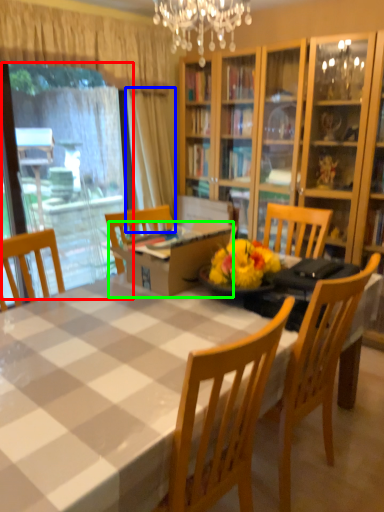
Question: Which object is the closest to the window screen (highlighted by a red box)? Choose among these: curtain (highlighted by a blue box) or cardboard box (highlighted by a green box).

Choices:
 (A) curtain
 (B) cardboard box

Answer: (A)